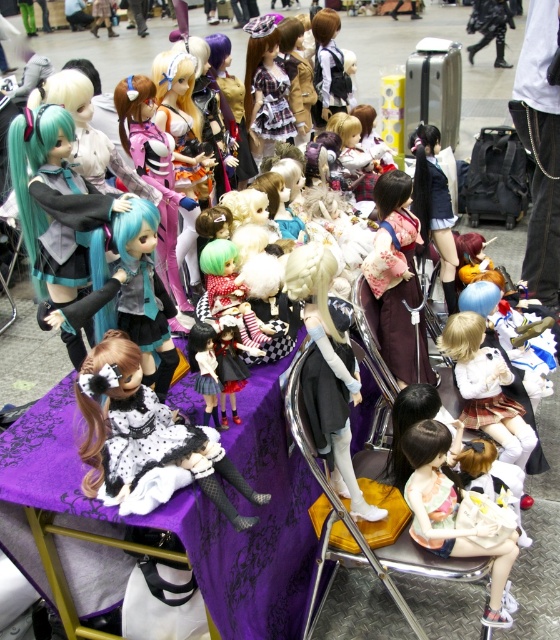
Question: Which object is positioned farthest from the matte black dress at center?

Choices:
 (A) matte pink fabric doll at center
 (B) black leather boots at upper right

Answer: (B)

Question: Based on their relative distances, which object is farther from the matte pink fabric doll at center?

Choices:
 (A) black leather boots at upper right
 (B) matte black dress at center

Answer: (A)

Question: Does matte black dress at center have a lesser width compared to teal matte wig at center?

Choices:
 (A) yes
 (B) no

Answer: (B)

Question: Which of these objects is positioned closest to the matte black dress at center?

Choices:
 (A) teal matte wig at center
 (B) matte pink fabric doll at center

Answer: (A)

Question: Is matte black dress at center bigger than matte pink fabric doll at center?

Choices:
 (A) yes
 (B) no

Answer: (A)

Question: Does matte black dress at center appear under teal matte wig at center?

Choices:
 (A) yes
 (B) no

Answer: (A)